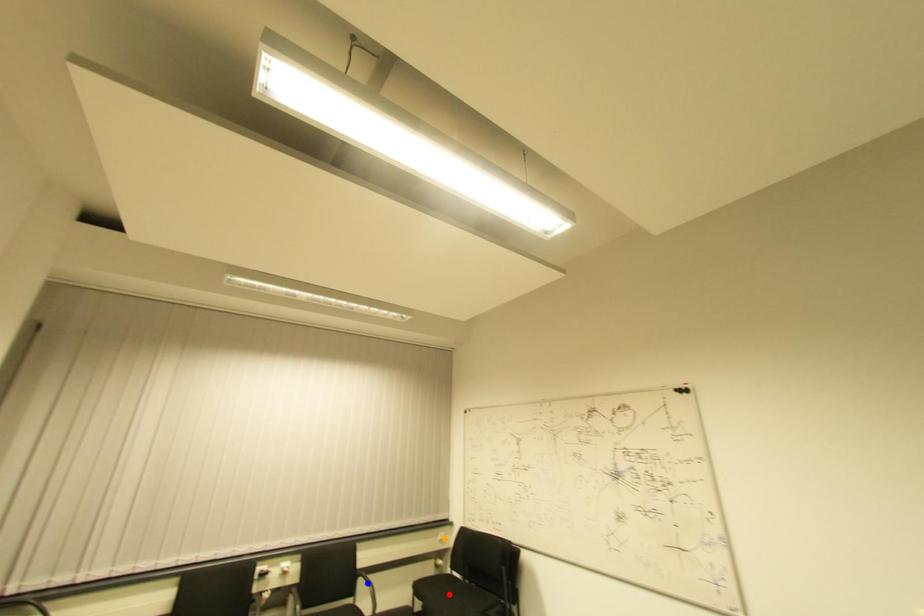
Order these from nearest to farthest:
1. orange point
2. red point
3. blue point

blue point, red point, orange point